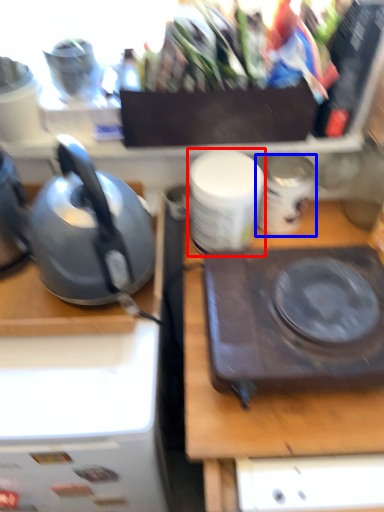
Question: Which object appears farthest to the camera in this image, tableware (highlighted by a red box) or appliance (highlighted by a blue box)?

Choices:
 (A) tableware
 (B) appliance

Answer: (B)